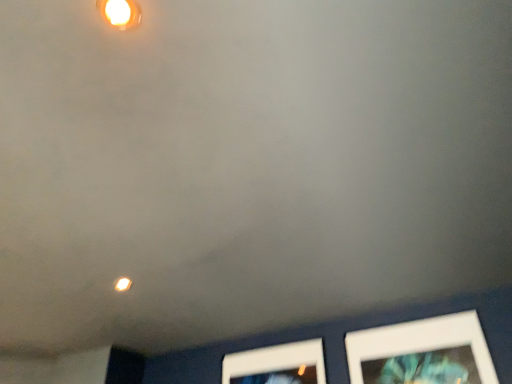
Question: Is white matte picture frame at lower right to the left or to the right of matte yellow light at upper left in the image?

Choices:
 (A) left
 (B) right

Answer: (B)

Question: Is white matte picture frame at lower right wider or thinner than matte yellow light at upper left?

Choices:
 (A) wide
 (B) thin

Answer: (B)

Question: Which object is positioned farthest from the matte yellow light at upper left?

Choices:
 (A) white matte picture frame at lower right
 (B) matte white light fixture at upper center

Answer: (A)

Question: Which object is positioned farthest from the matte yellow light at upper left?

Choices:
 (A) matte white light fixture at upper center
 (B) white matte picture frame at lower right

Answer: (B)